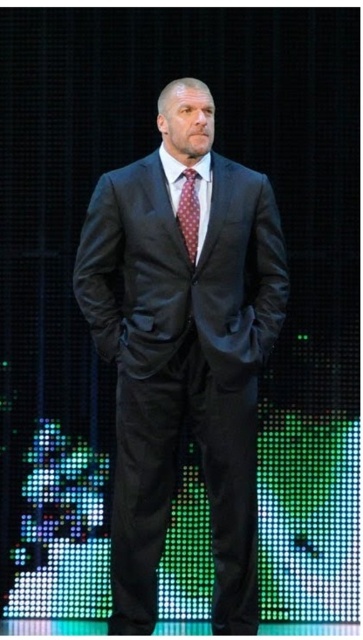
Question: Is matte black suit at center above polka dot silk tie at center?

Choices:
 (A) yes
 (B) no

Answer: (B)

Question: Among these objects, which one is nearest to the camera?

Choices:
 (A) polka dot silk tie at center
 (B) matte black suit at center

Answer: (B)

Question: Does matte black suit at center have a greater width compared to polka dot silk tie at center?

Choices:
 (A) yes
 (B) no

Answer: (A)

Question: Which point appears farthest from the camera in this image?

Choices:
 (A) (116, 604)
 (B) (180, 227)

Answer: (A)

Question: Can you confirm if matte black suit at center is bigger than polka dot silk tie at center?

Choices:
 (A) no
 (B) yes

Answer: (B)